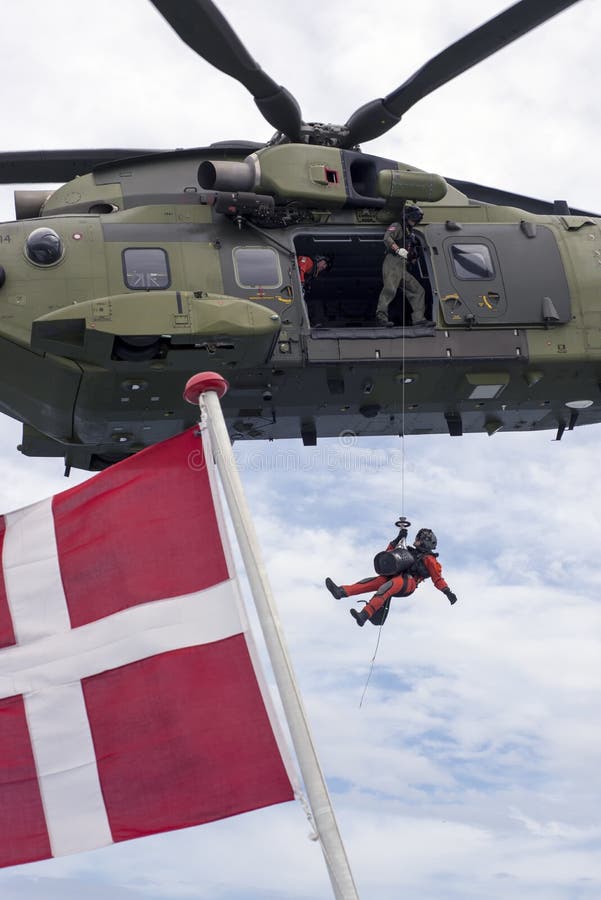
At what (x,y) coordinates should I click in order to perform the action: click on window. Please return your answer as a coordinate pair (x, y). The height and width of the screenshot is (900, 601). Looking at the image, I should click on (142, 268), (252, 265), (50, 240), (473, 266).